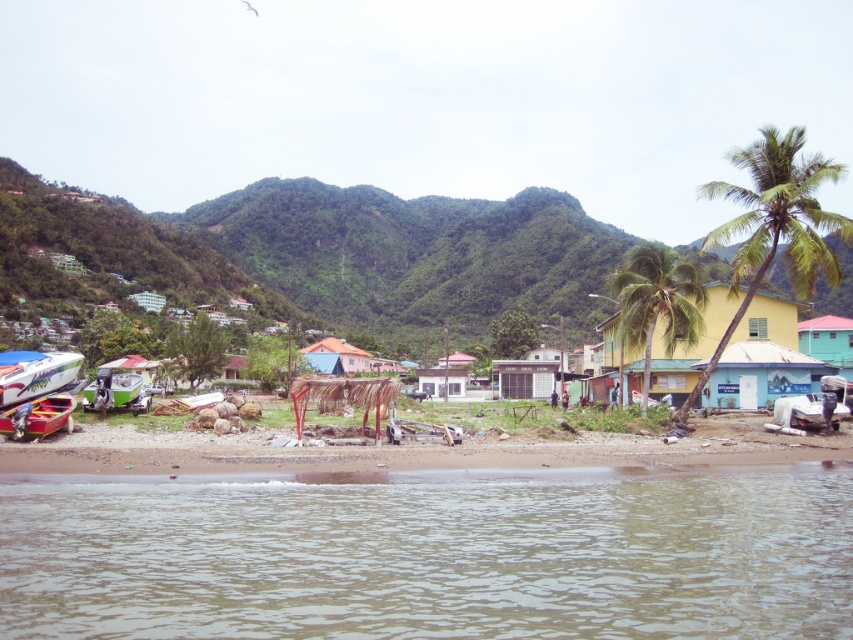
Can you confirm if red plastic boat at lower left is positioned above green corrugated metal hut at right?

Actually, red plastic boat at lower left is below green corrugated metal hut at right.

Which is more to the left, red plastic boat at lower left or green corrugated metal hut at right?

Positioned to the left is red plastic boat at lower left.

You are a GUI agent. You are given a task and a screenshot of the screen. Output one action in this format:
    pyautogui.click(x=<x>, y=<y>)
    Task: Click on the red plastic boat at lower left
    The image size is (853, 640).
    Given the screenshot: What is the action you would take?
    pyautogui.click(x=38, y=417)

Describe the element at coordinates (656, 304) in the screenshot. The height and width of the screenshot is (640, 853). I see `green leafy palm tree at center-right` at that location.

Between point (697, 305) and point (824, 330), which one is positioned in front?

Positioned in front is point (697, 305).

Measure the distance between green leafy palm tree at center-right and camera.

The distance of green leafy palm tree at center-right from camera is 43.34 meters.

At what (x,y) coordinates should I click in order to perform the action: click on green leafy palm tree at center-right. Please return your answer as a coordinate pair (x, y). The width and height of the screenshot is (853, 640). Looking at the image, I should click on (656, 304).

Does green corrugated metal hut at right lie behind blue corrugated metal hut at center?

No, it is not.

Which is more to the right, green corrugated metal hut at right or blue corrugated metal hut at center?

green corrugated metal hut at right

Which is behind, point (813, 337) or point (311, 348)?

The point (311, 348) is more distant.

You are a GUI agent. You are given a task and a screenshot of the screen. Output one action in this format:
    pyautogui.click(x=<x>, y=<y>)
    Task: Click on the green corrugated metal hut at right
    Image resolution: width=853 pixels, height=640 pixels.
    Given the screenshot: What is the action you would take?
    pyautogui.click(x=828, y=340)